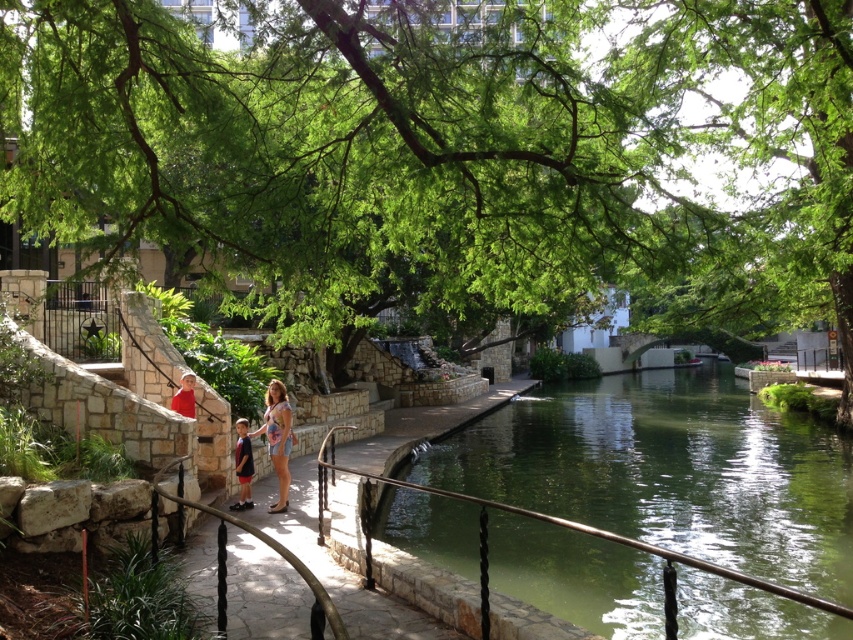
You are standing on the paved pathway at the riverside and see the green leafy tree at upper center and the green stone river at center. Which object is located to the left of the other?

The green leafy tree at upper center is positioned on the left side of green stone river at center.

You are a photographer trying to capture the entire scene in one shot. You notice the green leafy tree at upper center and the dark blue shorts at center. Which object would you need to adjust your camera angle to include more of in the frame?

The green leafy tree at upper center has a larger width than the dark blue shorts at center, so you would need to adjust your camera angle to include more of the green leafy tree at upper center in the frame.

You are planning to take a photo of the green leafy tree at upper center and the green stone river at center from the pathway. Which object will appear larger in the photo?

The green leafy tree at upper center will appear larger in the photo because it is bigger than the green stone river at center.